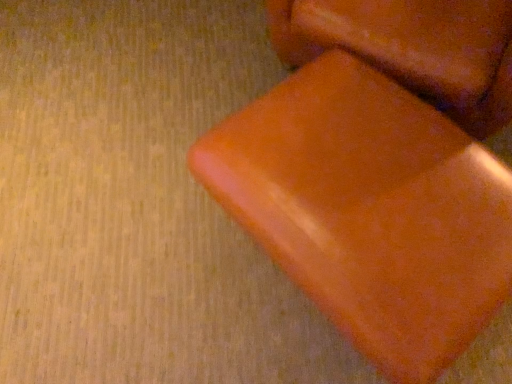
Identify the location of free location above orange matte bean bag chair at center (from a real-world perspective). pos(378,175).